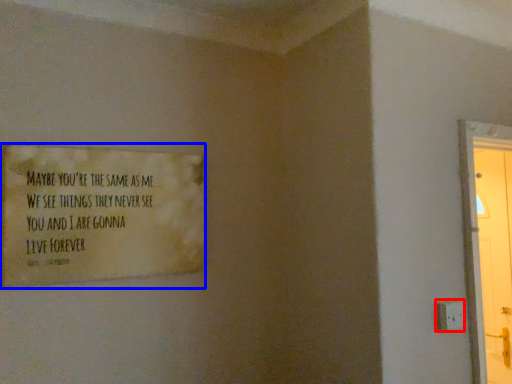
Question: Which of the following is the closest to the observer, electric outlet (highlighted by a red box) or poster (highlighted by a blue box)?

Choices:
 (A) electric outlet
 (B) poster

Answer: (B)